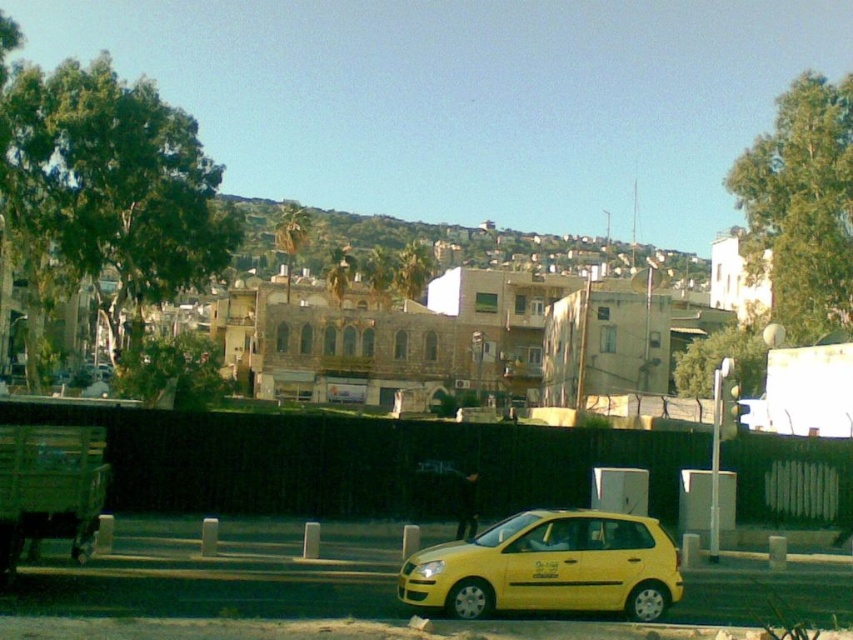
You are a pedestrian standing on the sidewalk and want to cross the street to reach the green grassy hillside at upper center. The yellow matte car at lower center is blocking your path. Can you walk around the car to your right side and still reach the hillside?

The yellow matte car at lower center is to the left of green grassy hillside at upper center, so if you walk around the car to your right side, you would be moving towards the hillside and can reach it.

You are standing at the yellow car parked on the side of the road facing left. You see two points marked in the image. Which point is closer to you, point (619, 557) or point (469, 264)?

Point (619, 557) is in front of point (469, 264), so it is closer to you.